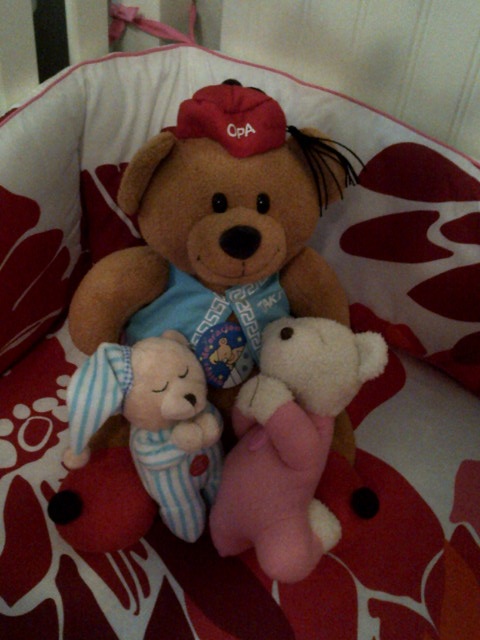
Identify the location of white wall. The width and height of the screenshot is (480, 640). (394, 33).